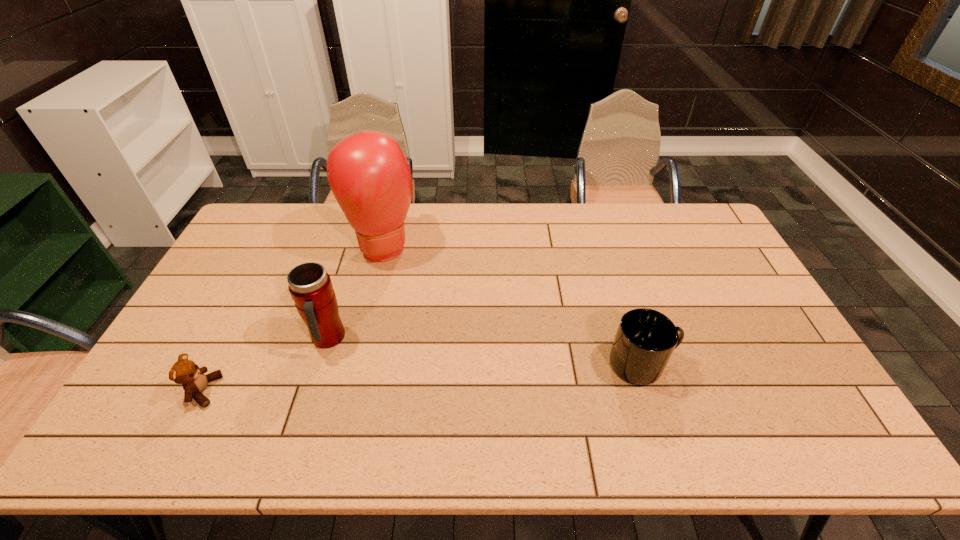
At what (x,y) coordinates should I click in order to perform the action: click on vacant space located on the side with the handle of the second tallest object. Please return your answer as a coordinate pair (x, y). This screenshot has width=960, height=540. Looking at the image, I should click on (354, 366).

You are a GUI agent. You are given a task and a screenshot of the screen. Output one action in this format:
    pyautogui.click(x=<x>, y=<y>)
    Task: Click on the free point located on the side with the handle of the second tallest object
    The image size is (960, 540).
    Given the screenshot: What is the action you would take?
    pyautogui.click(x=378, y=388)

Where is `vacant space positioned 0.340m on the striking surface of the tallest object`? The height and width of the screenshot is (540, 960). vacant space positioned 0.340m on the striking surface of the tallest object is located at coordinates (427, 346).

Identify the location of vacant space located on the striking surface of the tallest object. This screenshot has width=960, height=540. (427, 346).

Where is `free region located 0.110m on the striking surface of the tallest object`? free region located 0.110m on the striking surface of the tallest object is located at coordinates (403, 292).

At what (x,y) coordinates should I click in order to perform the action: click on object present at the far edge. Please return your answer as a coordinate pair (x, y). Image resolution: width=960 pixels, height=540 pixels. Looking at the image, I should click on (370, 177).

Where is `teddy bear located at the near edge`? The width and height of the screenshot is (960, 540). teddy bear located at the near edge is located at coordinates (194, 381).

This screenshot has width=960, height=540. I want to click on mug present at the near edge, so click(x=645, y=339).

Image resolution: width=960 pixels, height=540 pixels. In order to click on object at the left edge in this screenshot , I will do `click(194, 381)`.

This screenshot has height=540, width=960. In order to click on object located in the near left corner section of the desktop in this screenshot , I will do `click(194, 381)`.